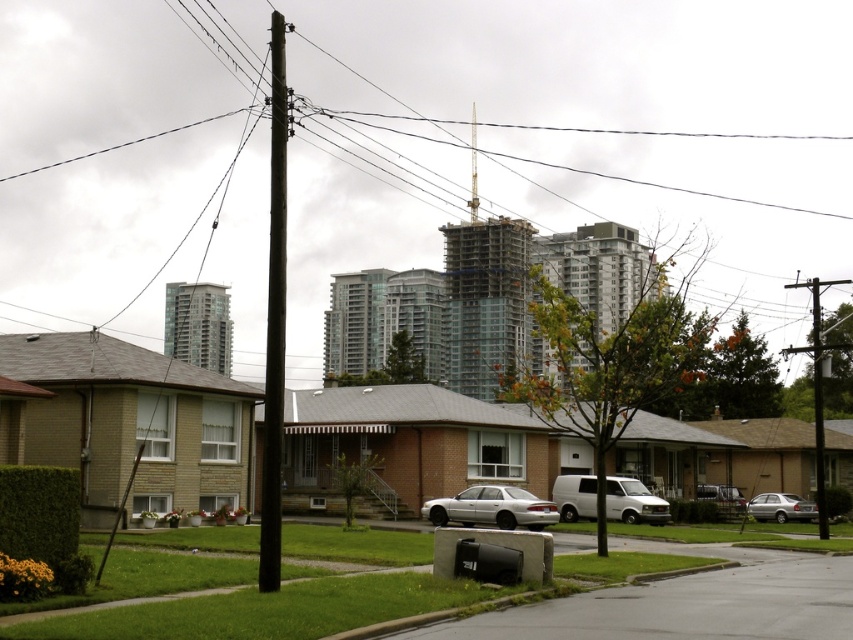
You are a delivery driver who needs to park your white matte van at center near the wooden telephone pole at right. Based on the scene, can your van fit under the power lines connected to the telephone pole without hitting them?

The white matte van at center is shorter than the wooden telephone pole at right, so it can fit under the power lines connected to the telephone pole without hitting them.

You are a drone operator trying to navigate between two points in the suburban scene. The first point is at coordinates point (x=283, y=296) and the second is at point (x=809, y=520). Which point is closer to you, the observer?

Point (x=283, y=296) is closer to the viewer than point (x=809, y=520), so the first point is closer.